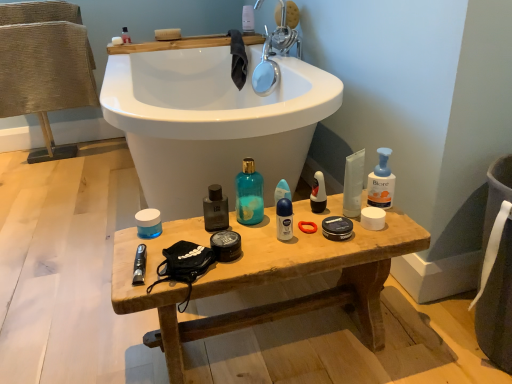
Identify the location of vacant space in front of textured woven fabric at upper left. pyautogui.click(x=51, y=175).